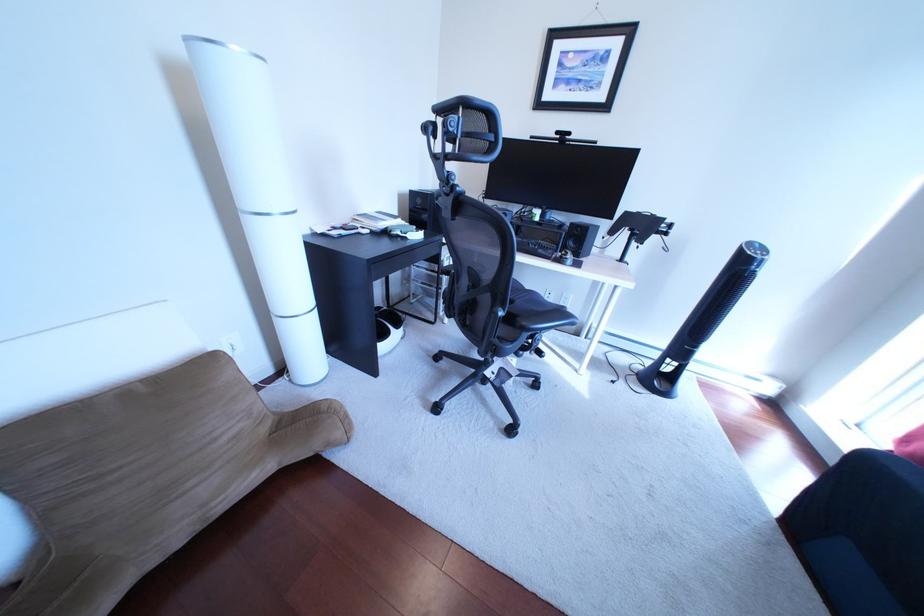
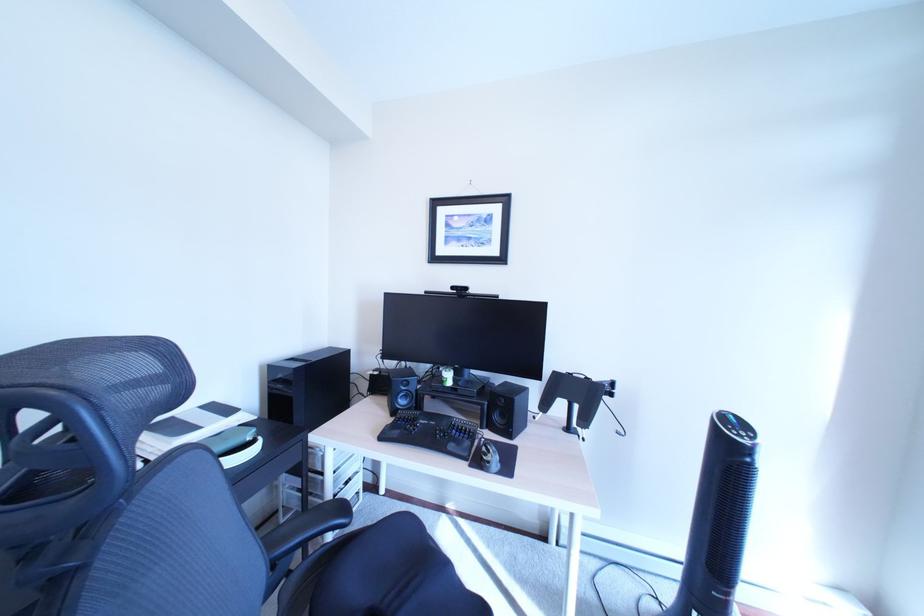
Question: How did the camera likely rotate?

Choices:
 (A) Left
 (B) Right
 (C) Up
 (D) Down

Answer: (C)